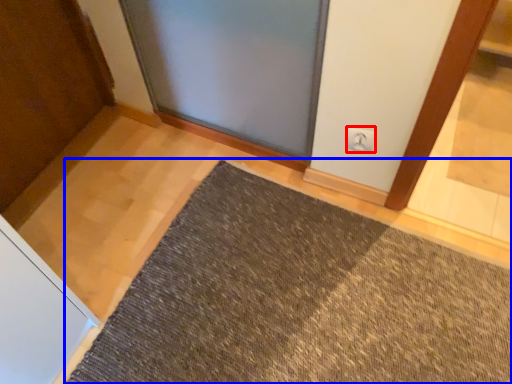
Question: Which of the following is the farthest to the observer, electric outlet (highlighted by a red box) or mat (highlighted by a blue box)?

Choices:
 (A) electric outlet
 (B) mat

Answer: (A)